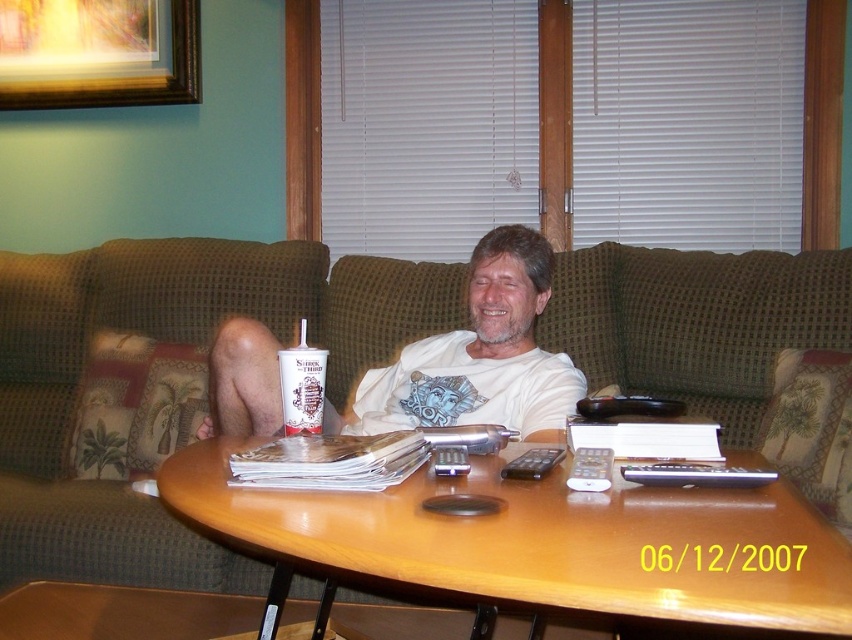
Does brown wood table at center appear on the right side of black plastic remote at center?

No, brown wood table at center is not to the right of black plastic remote at center.

Can you confirm if brown wood table at center is positioned to the left of black plastic remote at center?

Correct, you'll find brown wood table at center to the left of black plastic remote at center.

What do you see at coordinates (537, 545) in the screenshot?
I see `brown wood table at center` at bounding box center [537, 545].

Where is `brown wood table at center`? The height and width of the screenshot is (640, 852). brown wood table at center is located at coordinates (537, 545).

Which is below, green textured couch at center or white t-shirt at center?

white t-shirt at center is below.

Does green textured couch at center have a greater height compared to white t-shirt at center?

Yes, green textured couch at center is taller than white t-shirt at center.

Who is more forward, (102, 285) or (223, 346)?

Point (223, 346) is more forward.

The height and width of the screenshot is (640, 852). Find the location of `green textured couch at center`. green textured couch at center is located at coordinates (176, 340).

Is silver metallic remote at center positioned behind black plastic remote at center?

No, it is not.

Who is shorter, silver metallic remote at center or black plastic remote at center?

black plastic remote at center

Where is `silver metallic remote at center`? silver metallic remote at center is located at coordinates (695, 474).

The height and width of the screenshot is (640, 852). What are the coordinates of `silver metallic remote at center` in the screenshot? It's located at (695, 474).